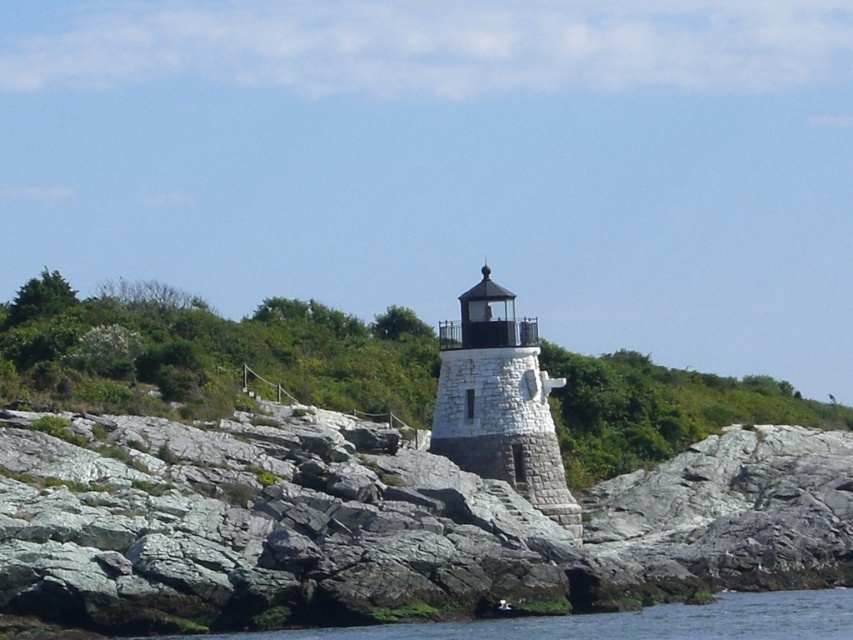
Is point (515, 540) positioned before point (509, 308)?

Yes, point (515, 540) is in front of point (509, 308).

Which is below, gray stone at center or white stone lighthouse at center?

gray stone at center is below.

Between point (181, 608) and point (503, 346), which one is positioned in front?

Point (181, 608)

Identify the location of gray stone at center. The image size is (853, 640). (386, 524).